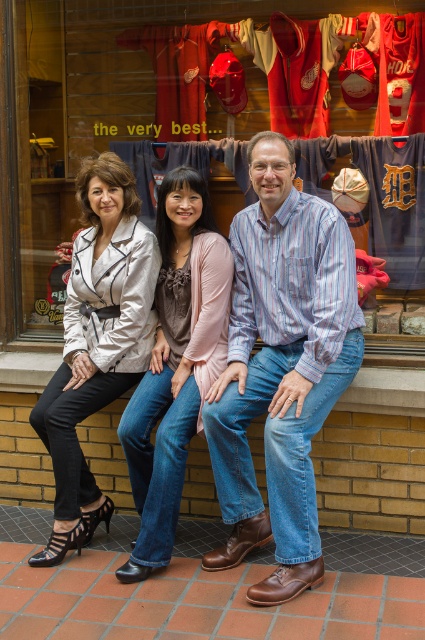
You are a photographer trying to capture a group photo of the blue striped shirt at center and the matte white blazer at center. Which one should you focus on first if you want to start from the left side?

The matte white blazer at center should be focused on first because it is positioned to the left of the blue striped shirt at center.

You are a fashion designer observing the three people sitting on the brick ledge. You need to determine which clothing item, the blue striped shirt at center or the matte white blazer at center, is taller in the image. Which one is taller?

The blue striped shirt at center is taller than the matte white blazer at center according to the description.